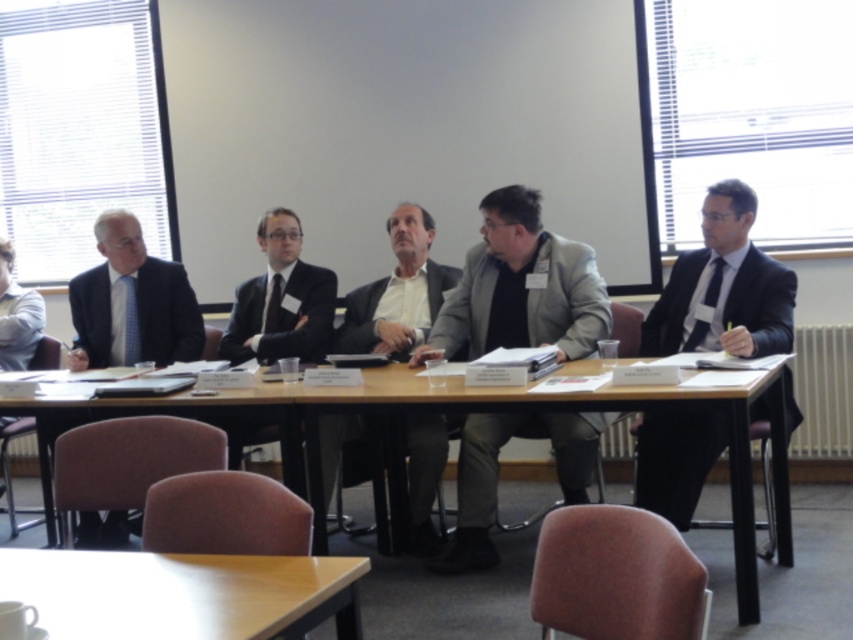
Question: Does light brown wood table at lower left come behind wooden table at center?

Choices:
 (A) no
 (B) yes

Answer: (A)

Question: Which object is farther from the camera taking this photo?

Choices:
 (A) light brown wood table at lower left
 (B) matte black suit at right
 (C) light blue shirt at left

Answer: (C)

Question: Can you confirm if gray fabric jacket at center is smaller than light blue shirt at left?

Choices:
 (A) no
 (B) yes

Answer: (A)

Question: Estimate the real-world distances between objects in this image. Which object is farther from the wooden table at center?

Choices:
 (A) light blue shirt at left
 (B) gray fabric jacket at center
 (C) matte gray suit at center

Answer: (A)

Question: Does matte black suit at right have a greater width compared to matte gray suit at center?

Choices:
 (A) yes
 (B) no

Answer: (A)

Question: Which object is farther from the camera taking this photo?

Choices:
 (A) wooden table at center
 (B) matte black suit at right
 (C) light blue shirt at left

Answer: (C)